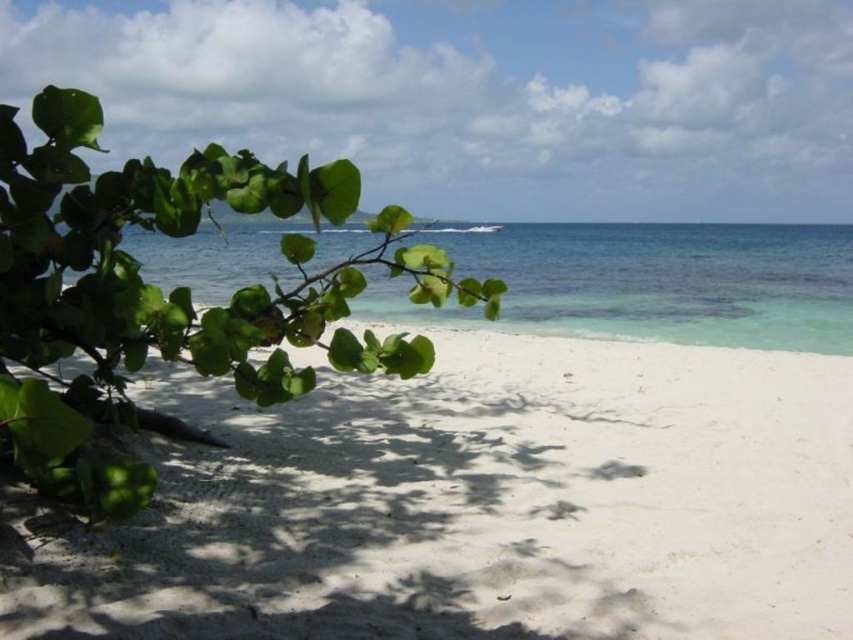
Does point (769, 522) lie behind point (328, 268)?

No, (769, 522) is closer to viewer.

Is white sandy beach at center to the left of green leafy branch at left from the viewer's perspective?

No, white sandy beach at center is not to the left of green leafy branch at left.

Where is `white sandy beach at center`? white sandy beach at center is located at coordinates (483, 504).

Can you confirm if white sandy beach at center is positioned below clear blue water at center?

Correct, white sandy beach at center is located below clear blue water at center.

Locate an element on the screen. This screenshot has width=853, height=640. white sandy beach at center is located at coordinates (483, 504).

Identify the location of white sandy beach at center. The image size is (853, 640). (483, 504).

Which of these two, green leafy branch at left or clear blue water at center, stands taller?

With more height is clear blue water at center.

Find the location of a particular element. This screenshot has height=640, width=853. green leafy branch at left is located at coordinates (169, 294).